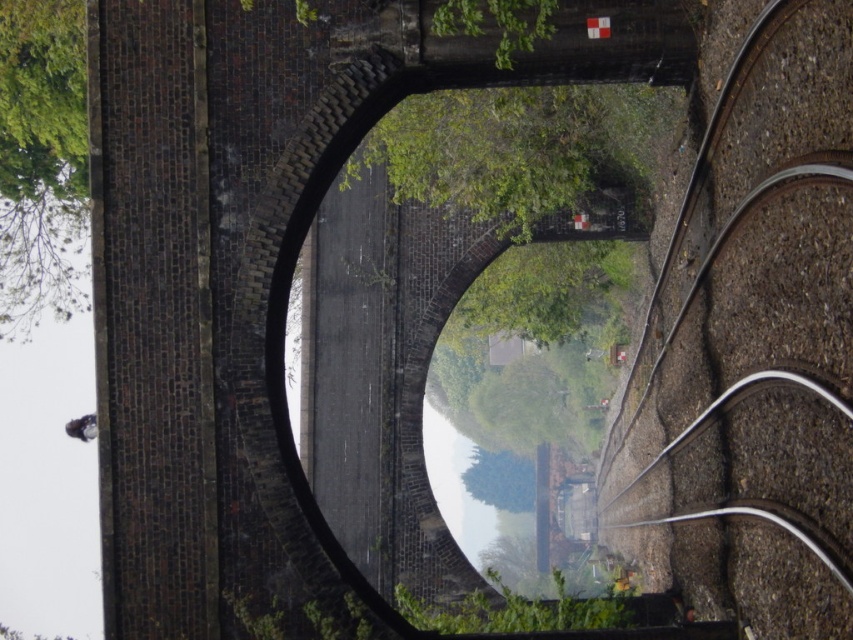
Question: Among these points, which one is nearest to the camera?

Choices:
 (A) (15, 214)
 (B) (781, 572)
 (C) (364, 166)

Answer: (B)

Question: Does green leafy tree at center have a lesser width compared to green leafy tree at upper left?

Choices:
 (A) yes
 (B) no

Answer: (A)

Question: Does brown gravel train track at right appear over green leafy tree at center?

Choices:
 (A) no
 (B) yes

Answer: (A)

Question: Based on their relative distances, which object is nearer to the brown gravel train track at right?

Choices:
 (A) green leafy tree at upper left
 (B) green leafy tree at center
 (C) brick at center

Answer: (B)

Question: Which point is closer to the camera taking this photo?

Choices:
 (A) (523, 108)
 (B) (161, 564)
 (C) (705, 470)

Answer: (B)

Question: Can you confirm if brown gravel train track at right is positioned to the right of green leafy tree at upper left?

Choices:
 (A) no
 (B) yes

Answer: (B)